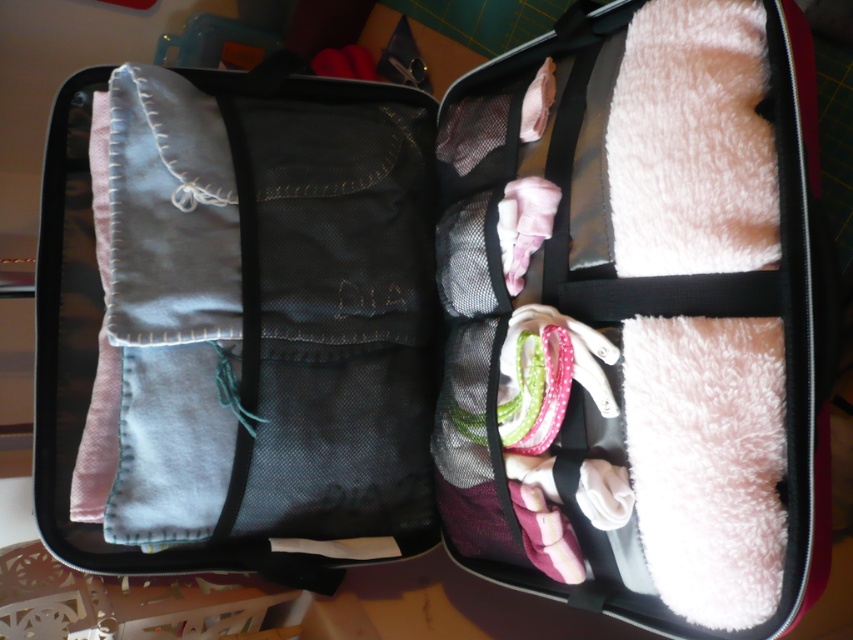
Between white fluffy towel at upper right and denim fabric pants at left, which one appears on the right side from the viewer's perspective?

From the viewer's perspective, white fluffy towel at upper right appears more on the right side.

Does white fluffy towel at upper right have a lesser width compared to denim fabric pants at left?

Yes, white fluffy towel at upper right is thinner than denim fabric pants at left.

This screenshot has height=640, width=853. What do you see at coordinates (633, 321) in the screenshot?
I see `white fluffy towel at upper right` at bounding box center [633, 321].

Image resolution: width=853 pixels, height=640 pixels. I want to click on white fluffy towel at upper right, so click(x=633, y=321).